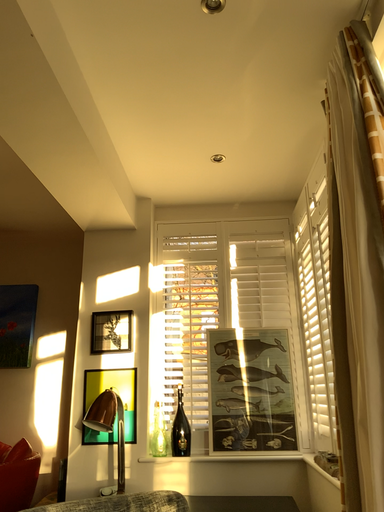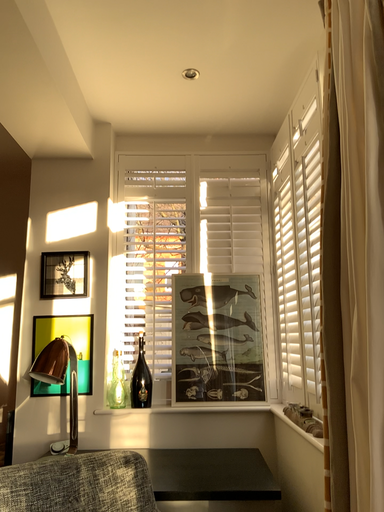
Question: How did the camera likely rotate when shooting the video?

Choices:
 (A) rotated upward
 (B) rotated downward

Answer: (B)